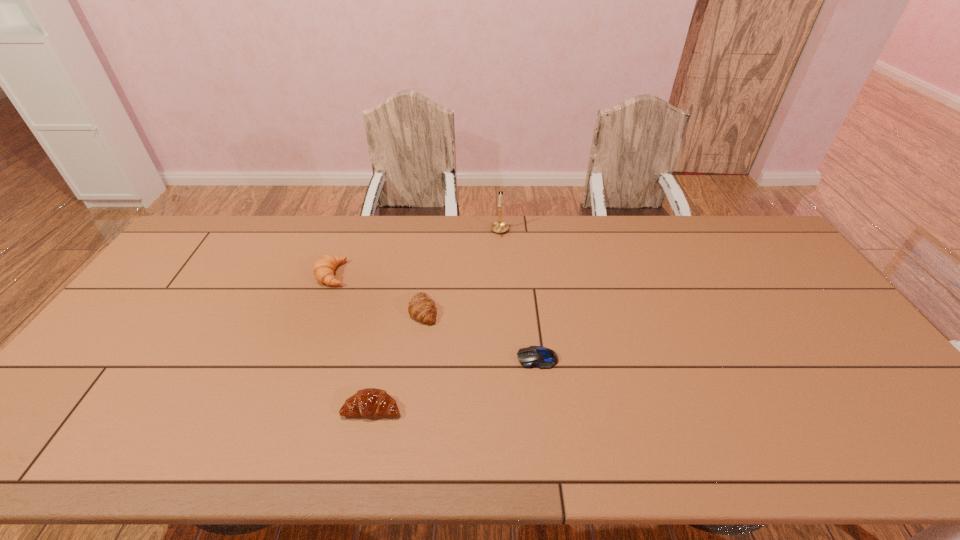
Identify which object is located as the nearest to the nearest crescent roll. Please provide its 2D coordinates. Your answer should be formatted as a tuple, i.e. [(x, y)], where the tuple contains the x and y coordinates of a point satisfying the conditions above.

[(421, 308)]

Identify which crescent roll is the nearest to the nearest object. Please provide its 2D coordinates. Your answer should be formatted as a tuple, i.e. [(x, y)], where the tuple contains the x and y coordinates of a point satisfying the conditions above.

[(421, 308)]

Locate which crescent roll is the second closest to the nearest crescent roll. Please provide its 2D coordinates. Your answer should be formatted as a tuple, i.e. [(x, y)], where the tuple contains the x and y coordinates of a point satisfying the conditions above.

[(323, 269)]